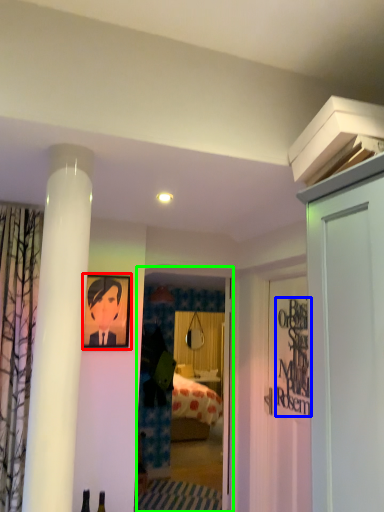
Question: Based on their relative distances, which object is nearer to picture frame (highlighted by a red box)? Choose from writing (highlighted by a blue box) and glass door (highlighted by a green box).

Choices:
 (A) writing
 (B) glass door

Answer: (A)